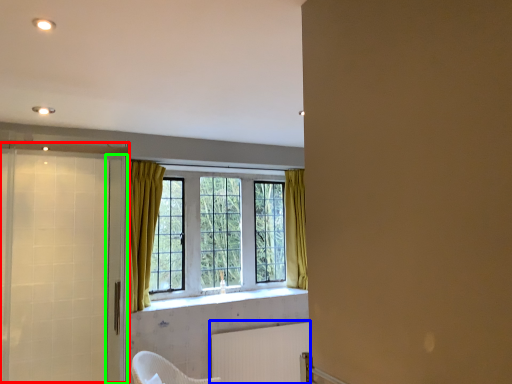
Question: Considering the real-world distances, which object is closest to screen door (highlighted by a red box)? radiator (highlighted by a blue box) or screen door (highlighted by a green box).

Choices:
 (A) radiator
 (B) screen door

Answer: (B)